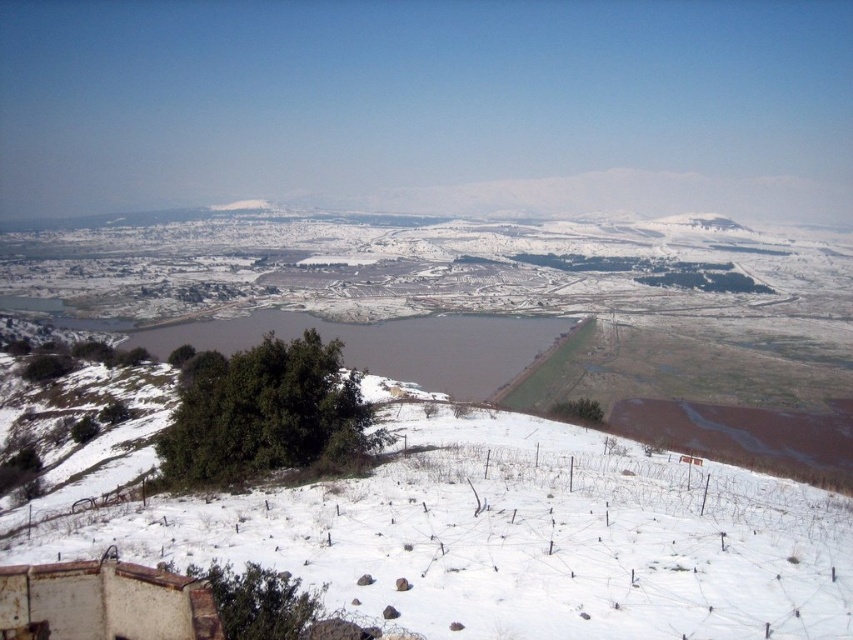
Question: Does white powdery snow at center appear over brown matte lake at center?

Choices:
 (A) yes
 (B) no

Answer: (B)

Question: Can you confirm if white powdery snow at center is positioned below brown matte lake at center?

Choices:
 (A) no
 (B) yes

Answer: (B)

Question: Can you confirm if white powdery snow at center is positioned to the right of brown matte lake at center?

Choices:
 (A) no
 (B) yes

Answer: (B)

Question: Which object is closer to the camera taking this photo?

Choices:
 (A) white powdery snow at center
 (B) brown matte lake at center

Answer: (A)

Question: Which of the following is the farthest from the observer?

Choices:
 (A) white powdery snow at center
 (B) brown matte lake at center

Answer: (B)